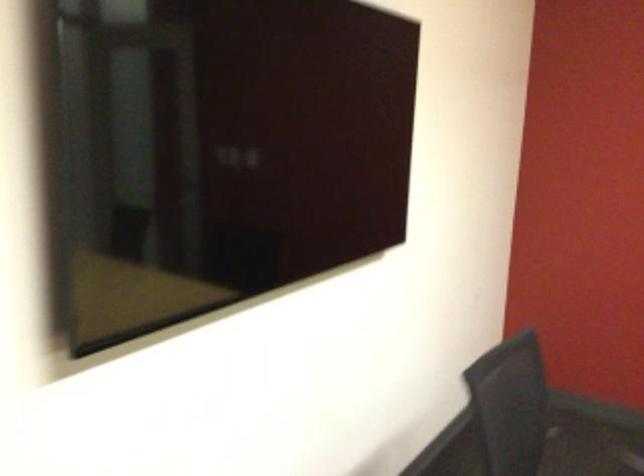
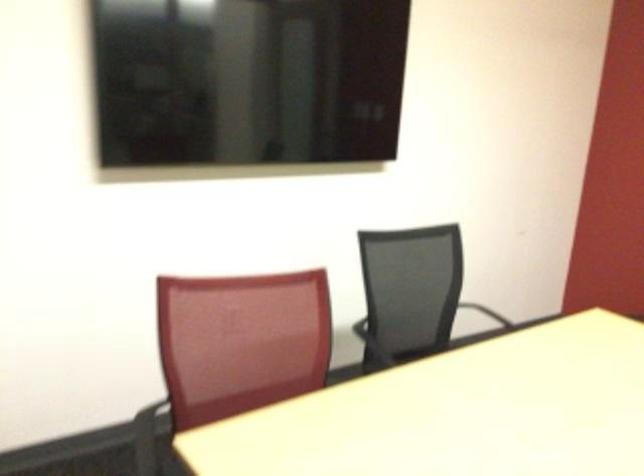
From the picture: What movement of the cameraman would produce the second image?

The cameraman walked toward right, backward.